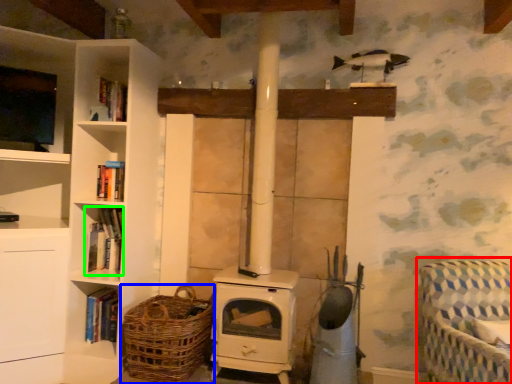
Question: Which is farther away from rocking chair (highlighted by a red box)? basket (highlighted by a blue box) or book (highlighted by a green box)?

Choices:
 (A) basket
 (B) book

Answer: (B)